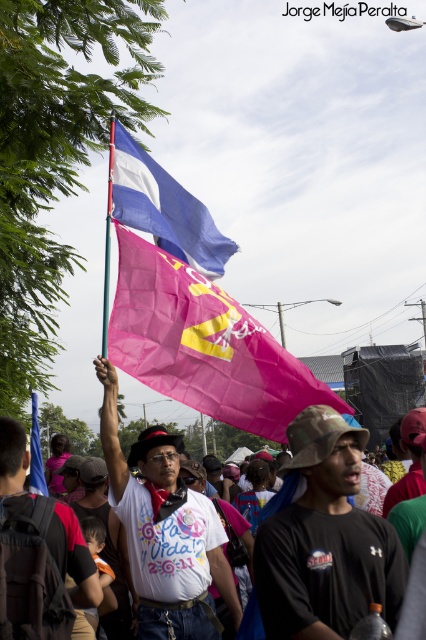
Question: Does white matte t-shirt at center appear on the left side of white t-shirt at center?

Choices:
 (A) no
 (B) yes

Answer: (A)

Question: Is black matte shirt at center wider than white matte t-shirt at center?

Choices:
 (A) yes
 (B) no

Answer: (A)

Question: Which point is closer to the camera?

Choices:
 (A) (40, 477)
 (B) (103, 417)
 (C) (402, 572)
 (D) (129, 156)

Answer: (C)

Question: Estimate the real-world distances between objects in this image. Which object is closer to the white matte t-shirt at center?

Choices:
 (A) blue fabric flag at upper left
 (B) black matte shirt at center
 (C) blue fabric flag at upper center
 (D) white t-shirt at center

Answer: (C)

Question: Based on their relative distances, which object is farther from the blue fabric flag at upper left?

Choices:
 (A) pink fabric flag at center
 (B) black matte shirt at center
 (C) blue fabric flag at upper center
 (D) white matte t-shirt at center

Answer: (C)

Question: Does pink fabric flag at center have a lesser width compared to white matte t-shirt at center?

Choices:
 (A) no
 (B) yes

Answer: (A)